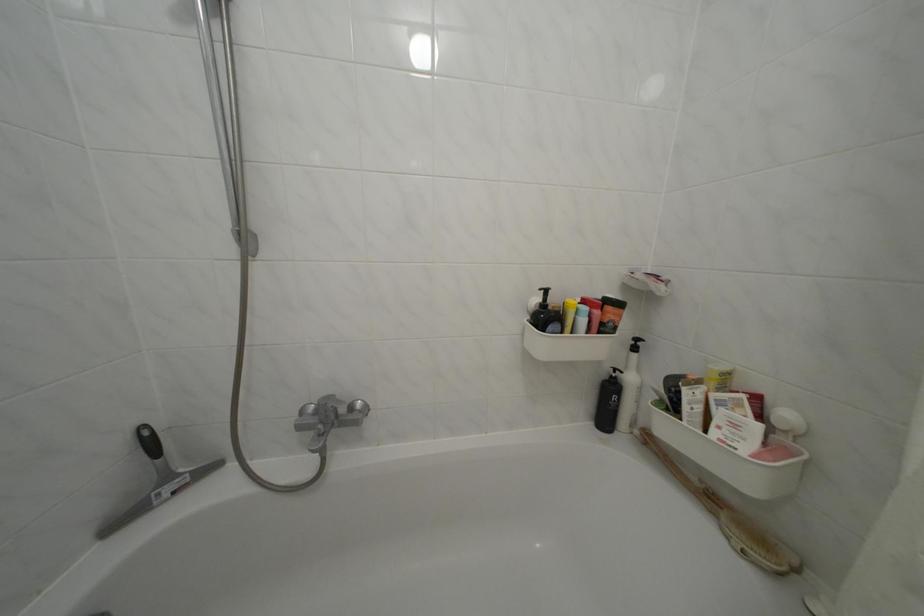
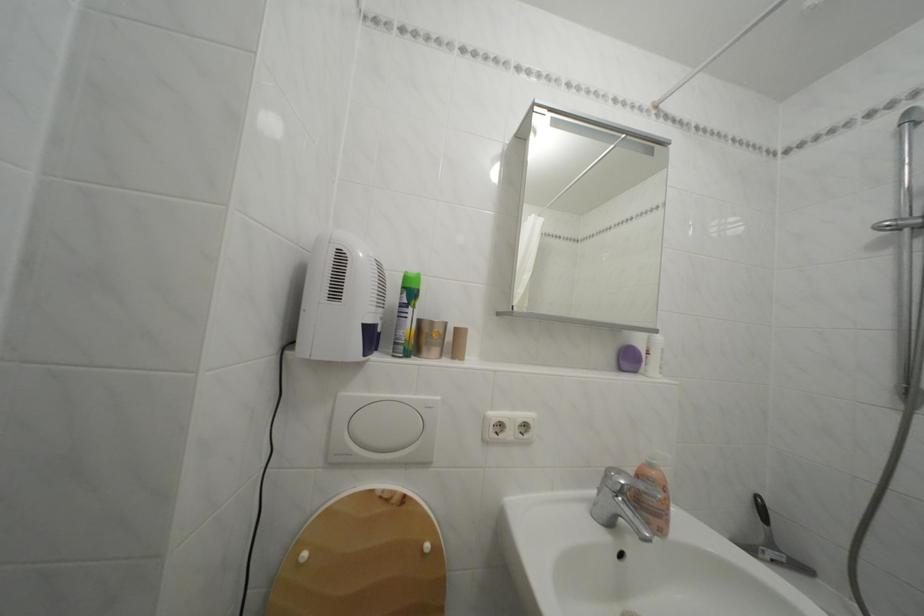
Question: The first image is from the beginning of the video and the second image is from the end. How did the camera likely rotate when shooting the video?

Choices:
 (A) Left
 (B) Right
 (C) Up
 (D) Down

Answer: (A)